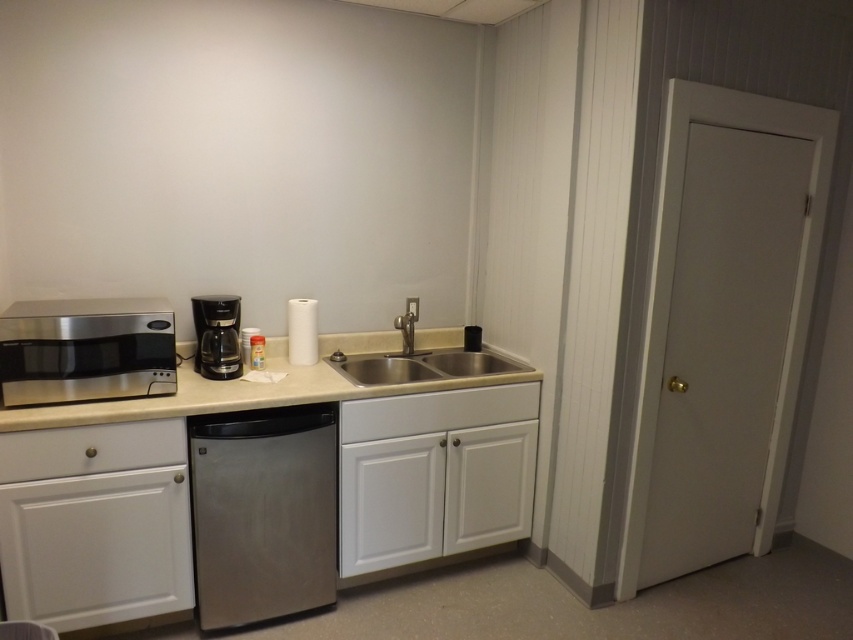
You are standing in front of the kitchenette and want to reach both the point at (199, 384) and the point at (386, 429). Which point will you reach first?

You will reach the point at (199, 384) first because it is closer to you than the point at (386, 429).

You are a delivery person who needs to place a rectangular box that is 10 inches long on the beige laminate counter top at center. However, there is a white matte cabinet at center nearby. Can you fit the box entirely on the counter without it hanging off the edge near the cabinet?

The distance between the beige laminate counter top at center and the white matte cabinet at center is 9.56 inches. Since the box is 10 inches long, it cannot be placed entirely on the counter without overlapping the cabinet or hanging off the edge.